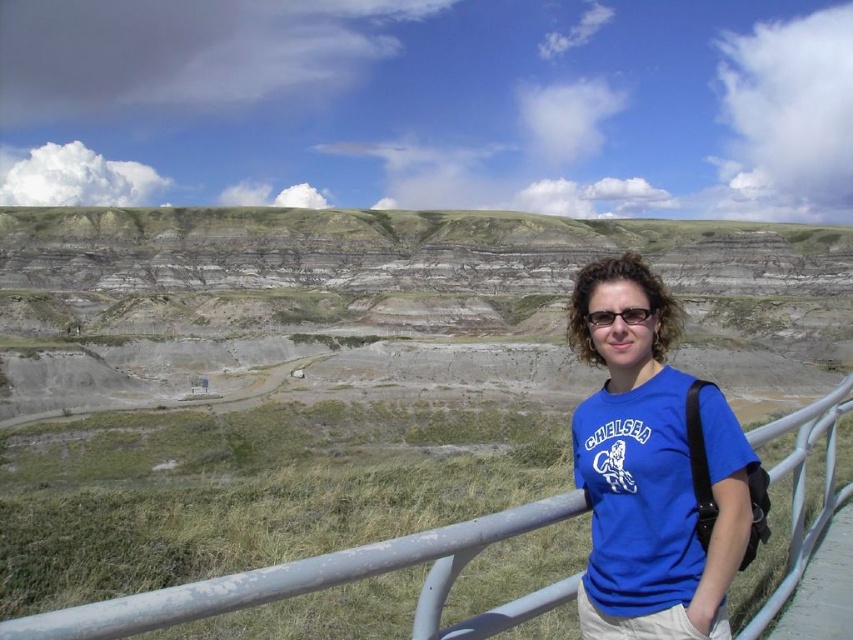
You are a drone operator trying to capture a photo of the blue cotton shirt at center and the black plastic glasses at center from above. The camera has a minimum focus distance of 2 meters. Can you focus on both objects at the same time?

The blue cotton shirt at center is 3.07 meters away from the black plastic glasses at center. Since the minimum focus distance is 2 meters, the drone can focus on both objects simultaneously as they are within the required range.